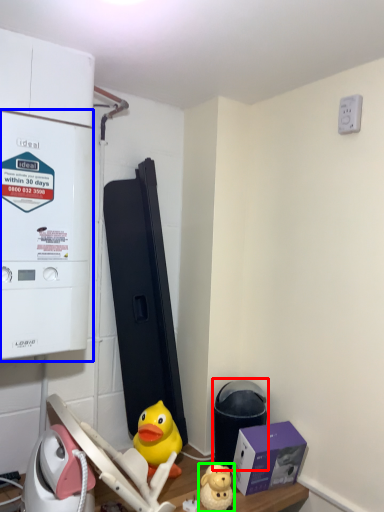
Question: Which is nearer to the water heater (highlighted by a red box)? appliance (highlighted by a blue box) or toy (highlighted by a green box).

Choices:
 (A) appliance
 (B) toy

Answer: (B)